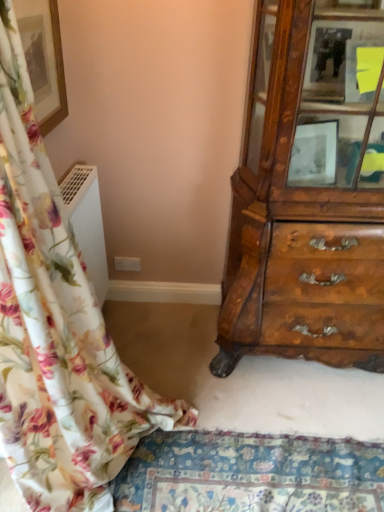
The image size is (384, 512). Find the location of `floral fabric curtain at left`. floral fabric curtain at left is located at coordinates (57, 329).

Image resolution: width=384 pixels, height=512 pixels. What do you see at coordinates (250, 473) in the screenshot? I see `floral fabric mat at lower center` at bounding box center [250, 473].

Where is `matte gold picture frame at upper left`? matte gold picture frame at upper left is located at coordinates (44, 59).

Is floral fabric curtain at left at the back of floral fabric mat at lower center?

That's right, floral fabric mat at lower center is facing away from floral fabric curtain at left.

From a real-world perspective, relative to floral fabric curtain at left, is floral fabric mat at lower center vertically above or below?

In terms of real-world spatial position, floral fabric mat at lower center is below floral fabric curtain at left.

Is floral fabric mat at lower center positioned in front of floral fabric curtain at left?

No, floral fabric mat at lower center is further to the viewer.

Which object is positioned more to the right, floral fabric mat at lower center or floral fabric curtain at left?

floral fabric mat at lower center is more to the right.

Is wooden cabinet at right shorter than floral fabric mat at lower center?

No.

Between wooden cabinet at right and floral fabric mat at lower center, which one has larger width?

floral fabric mat at lower center is wider.

There is a floral fabric mat at lower center. At what (x,y) coordinates should I click in order to perform the action: click on the chest of drawers above it (from a real-world perspective). Please return your answer as a coordinate pair (x, y). Looking at the image, I should click on (310, 195).

From the image's perspective, which one is positioned lower, wooden cabinet at right or floral fabric mat at lower center?

From the image's view, floral fabric mat at lower center is below.

Between matte gold picture frame at upper left and floral fabric curtain at left, which one has larger width?

floral fabric curtain at left.

Is floral fabric curtain at left inside matte gold picture frame at upper left?

No, floral fabric curtain at left is not a part of matte gold picture frame at upper left.

Considering the positions of objects matte gold picture frame at upper left and floral fabric curtain at left in the image provided, who is behind, matte gold picture frame at upper left or floral fabric curtain at left?

matte gold picture frame at upper left is further away from the camera.

Which of these two, matte gold picture frame at upper left or floral fabric curtain at left, is bigger?

floral fabric curtain at left.

Looking at this image, considering the relative sizes of floral fabric curtain at left and matte gold picture frame at upper left in the image provided, is floral fabric curtain at left thinner than matte gold picture frame at upper left?

Incorrect, the width of floral fabric curtain at left is not less than that of matte gold picture frame at upper left.

Which is more to the left, floral fabric curtain at left or matte gold picture frame at upper left?

From the viewer's perspective, matte gold picture frame at upper left appears more on the left side.

Consider the image. Between floral fabric curtain at left and matte gold picture frame at upper left, which one has more height?

With more height is floral fabric curtain at left.

This screenshot has height=512, width=384. There is a floral fabric curtain at left. What are the coordinates of `picture frame above it (from a real-world perspective)` in the screenshot? It's located at (44, 59).

Looking at this image, between wooden cabinet at right and matte gold picture frame at upper left, which one has smaller width?

matte gold picture frame at upper left is thinner.

Who is taller, wooden cabinet at right or matte gold picture frame at upper left?

Standing taller between the two is wooden cabinet at right.

Is wooden cabinet at right facing away from matte gold picture frame at upper left?

That's not correct — wooden cabinet at right is not looking away from matte gold picture frame at upper left.

From a real-world perspective, between wooden cabinet at right and matte gold picture frame at upper left, who is vertically lower?

wooden cabinet at right, from a real-world perspective.

Does matte gold picture frame at upper left touch floral fabric mat at lower center?

No, matte gold picture frame at upper left is not next to floral fabric mat at lower center.

Is matte gold picture frame at upper left looking in the opposite direction of floral fabric mat at lower center?

No, matte gold picture frame at upper left is not facing away from floral fabric mat at lower center.

Considering the positions of objects matte gold picture frame at upper left and floral fabric mat at lower center in the image provided, who is in front, matte gold picture frame at upper left or floral fabric mat at lower center?

matte gold picture frame at upper left is closer to the camera.

Is floral fabric mat at lower center located within matte gold picture frame at upper left?

That's incorrect, floral fabric mat at lower center is not inside matte gold picture frame at upper left.

How many degrees apart are the facing directions of floral fabric mat at lower center and wooden cabinet at right?

91.7 degrees separate the facing orientations of floral fabric mat at lower center and wooden cabinet at right.

In the image, is floral fabric mat at lower center positioned in front of or behind wooden cabinet at right?

floral fabric mat at lower center is behind wooden cabinet at right.

Considering the positions of objects floral fabric mat at lower center and wooden cabinet at right in the image provided, who is more to the right, floral fabric mat at lower center or wooden cabinet at right?

wooden cabinet at right is more to the right.

Would you say floral fabric mat at lower center is outside wooden cabinet at right?

floral fabric mat at lower center lies outside wooden cabinet at right's area.

In the image, there is a floral fabric curtain at left. At what (x,y) coordinates should I click in order to perform the action: click on mat below it (from the image's perspective). Please return your answer as a coordinate pair (x, y). The image size is (384, 512). Looking at the image, I should click on (250, 473).

Find the location of a particular element. The height and width of the screenshot is (512, 384). the chest of drawers that is above the floral fabric mat at lower center (from the image's perspective) is located at coordinates (310, 195).

Based on their spatial positions, is wooden cabinet at right or floral fabric mat at lower center further from floral fabric curtain at left?

wooden cabinet at right.

Looking at the image, which one is located closer to wooden cabinet at right, floral fabric curtain at left or matte gold picture frame at upper left?

Among the two, floral fabric curtain at left is located nearer to wooden cabinet at right.

Based on their spatial positions, is matte gold picture frame at upper left or wooden cabinet at right further from floral fabric curtain at left?

wooden cabinet at right lies further to floral fabric curtain at left than the other object.

Considering their positions, is matte gold picture frame at upper left positioned further to wooden cabinet at right than floral fabric curtain at left?

matte gold picture frame at upper left is further to wooden cabinet at right.

From the image, which object appears to be nearer to floral fabric curtain at left, wooden cabinet at right or matte gold picture frame at upper left?

Among the two, matte gold picture frame at upper left is located nearer to floral fabric curtain at left.

When comparing their distances from floral fabric curtain at left, does floral fabric mat at lower center or wooden cabinet at right seem closer?

floral fabric mat at lower center is closer to floral fabric curtain at left.

Which object lies further to the anchor point wooden cabinet at right, matte gold picture frame at upper left or floral fabric mat at lower center?

matte gold picture frame at upper left lies further to wooden cabinet at right than the other object.

Based on their spatial positions, is floral fabric curtain at left or wooden cabinet at right closer to floral fabric mat at lower center?

Among the two, floral fabric curtain at left is located nearer to floral fabric mat at lower center.

The height and width of the screenshot is (512, 384). Find the location of `curtain between matte gold picture frame at upper left and wooden cabinet at right from left to right`. curtain between matte gold picture frame at upper left and wooden cabinet at right from left to right is located at coordinates (57, 329).

Locate an element on the screen. curtain that lies between wooden cabinet at right and floral fabric mat at lower center from top to bottom is located at coordinates pos(57,329).

Identify the location of curtain between matte gold picture frame at upper left and floral fabric mat at lower center in the up-down direction. (57, 329).

The height and width of the screenshot is (512, 384). Identify the location of the chest of drawers between matte gold picture frame at upper left and floral fabric mat at lower center vertically. click(310, 195).